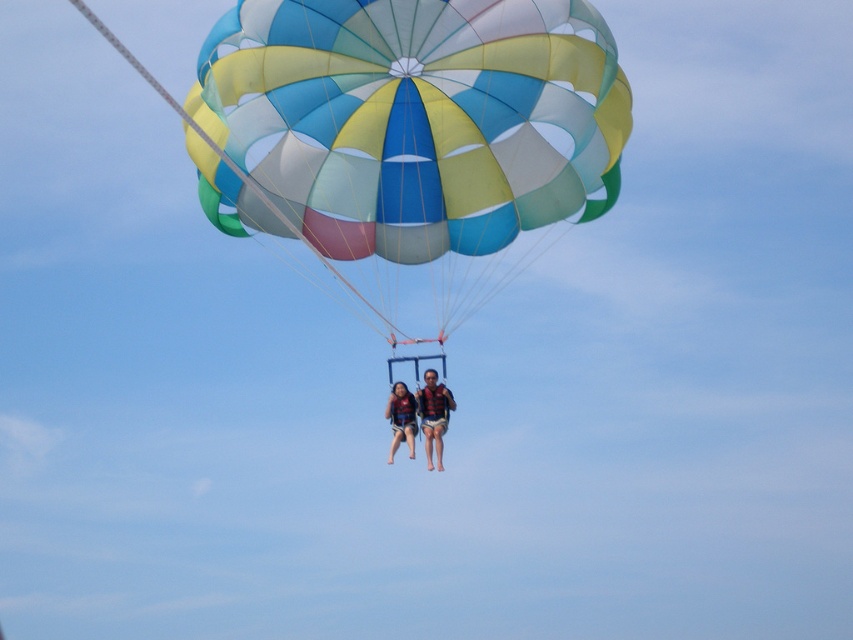
You are a photographer trying to capture the parasailers. You notice two points on the parachute canopy at coordinates point [428,186] and point [433,381]. Which point should you focus on to ensure it appears larger in your photo?

Point [428,186] is closer to the viewer than point [433,381], so focusing on point [428,186] will make it appear larger in the photo.

You are a photographer standing at the camera position. You want to capture a closeup shot of the matte black life vest at center. Given that your camera can focus up to 100 meters, will you be able to take the photo?

The distance between the matte black life vest at center and the camera is 93.29 meters, which is within the camera focus range of up to 100 meters. Therefore, you can take the photo.